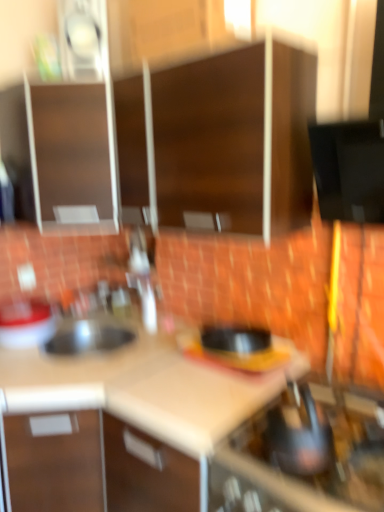
Question: From a real-world perspective, is metallic silver kettle at lower right located higher than wooden cabinet at upper center, arranged as the 2th cabinetry when viewed from the right?

Choices:
 (A) yes
 (B) no

Answer: (B)

Question: Is metallic silver kettle at lower right taller than wooden cabinet at upper center, arranged as the 2th cabinetry when viewed from the right?

Choices:
 (A) yes
 (B) no

Answer: (B)

Question: Is metallic silver kettle at lower right touching wooden cabinet at upper center, acting as the second cabinetry starting from the left?

Choices:
 (A) yes
 (B) no

Answer: (B)

Question: Is metallic silver kettle at lower right oriented away from wooden cabinet at upper center, arranged as the 2th cabinetry when viewed from the right?

Choices:
 (A) yes
 (B) no

Answer: (B)

Question: Can you confirm if metallic silver kettle at lower right is shorter than wooden cabinet at upper center, arranged as the 2th cabinetry when viewed from the right?

Choices:
 (A) yes
 (B) no

Answer: (A)

Question: From the image's perspective, is matte brown cabinet at upper left, the 1th cabinetry when ordered from left to right, located above or below wooden cabinet at center, arranged as the first cabinetry when viewed from the right?

Choices:
 (A) above
 (B) below

Answer: (A)

Question: Does point (26, 138) appear closer or farther from the camera than point (268, 137)?

Choices:
 (A) closer
 (B) farther

Answer: (B)

Question: From a real-world perspective, relative to wooden cabinet at center, which is the third cabinetry from left to right, is matte brown cabinet at upper left, which appears as the third cabinetry when viewed from the right, vertically above or below?

Choices:
 (A) below
 (B) above

Answer: (A)

Question: Do you think matte brown cabinet at upper left, which appears as the third cabinetry when viewed from the right, is within wooden cabinet at center, arranged as the first cabinetry when viewed from the right, or outside of it?

Choices:
 (A) outside
 (B) inside

Answer: (A)

Question: Based on their positions, is wooden cabinet at upper center, arranged as the 2th cabinetry when viewed from the right, located to the left or right of beige laminate countertop at center?

Choices:
 (A) left
 (B) right

Answer: (B)

Question: Looking at the image, does wooden cabinet at upper center, acting as the second cabinetry starting from the left, seem bigger or smaller compared to beige laminate countertop at center?

Choices:
 (A) big
 (B) small

Answer: (B)

Question: In terms of width, does wooden cabinet at upper center, acting as the second cabinetry starting from the left, look wider or thinner when compared to beige laminate countertop at center?

Choices:
 (A) wide
 (B) thin

Answer: (B)

Question: From the image's perspective, is wooden cabinet at upper center, arranged as the 2th cabinetry when viewed from the right, located above or below beige laminate countertop at center?

Choices:
 (A) above
 (B) below

Answer: (A)

Question: From the image's perspective, is matte white sink at left located above or below beige laminate counter top at center, marked as the 1th counter top in a right-to-left arrangement?

Choices:
 (A) below
 (B) above

Answer: (B)

Question: Considering their positions, is matte white sink at left located in front of or behind beige laminate counter top at center, marked as the 1th counter top in a right-to-left arrangement?

Choices:
 (A) front
 (B) behind

Answer: (B)